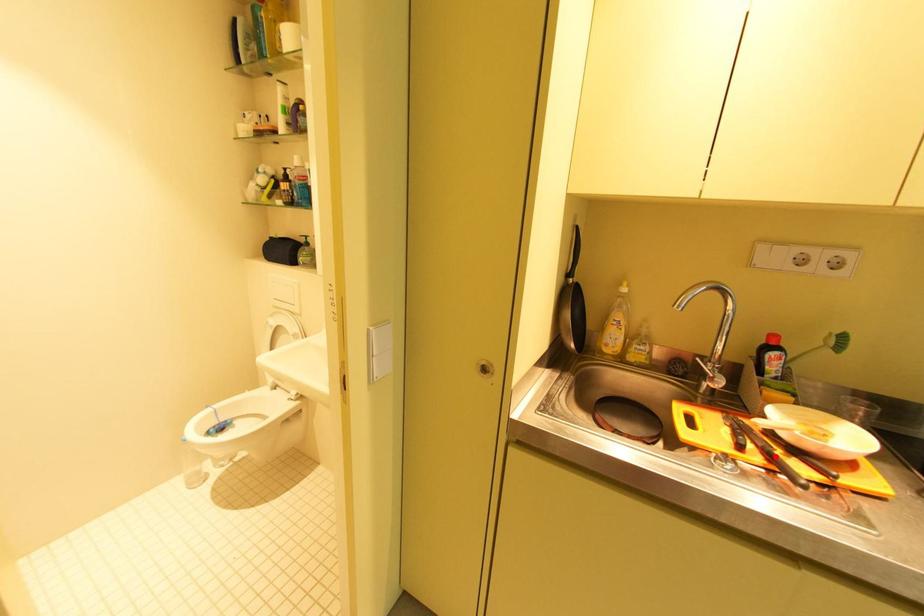
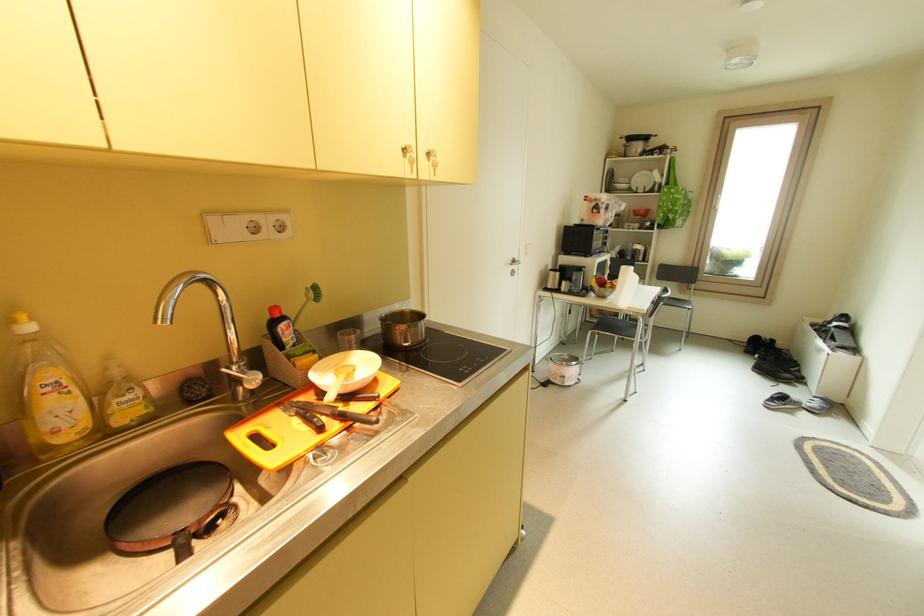
Locate, in the second image, the point that corresponds to the highlighted location in the first image.

(347, 418)